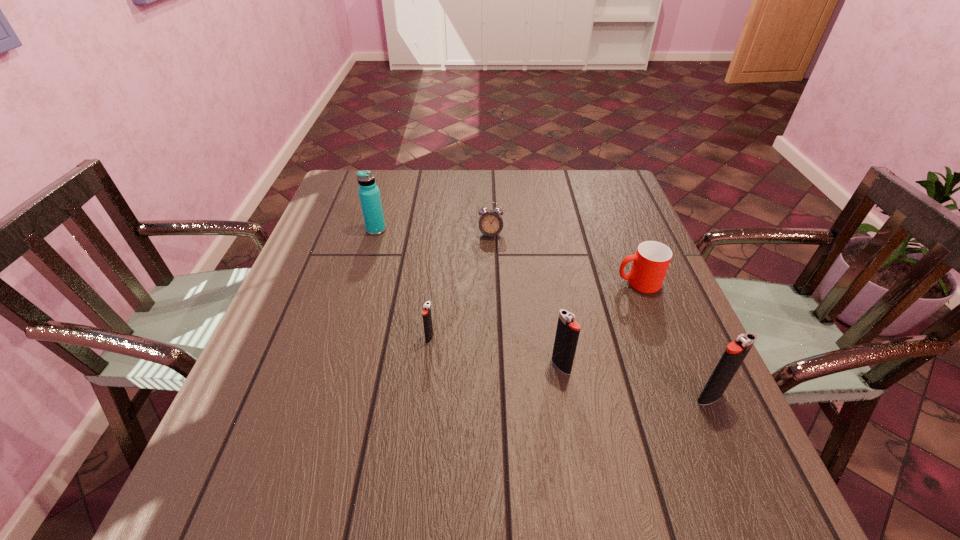
Identify the location of vacant area that satisfies the following two spatial constraints: 1. on the front side of the nearest igniter; 2. on the right side of the leftmost object. The image size is (960, 540). (326, 398).

At what (x,y) coordinates should I click in order to perform the action: click on free space that satisfies the following two spatial constraints: 1. on the front side of the leftmost object; 2. on the side of the third farthest object with the handle. Please return your answer as a coordinate pair (x, y). This screenshot has height=540, width=960. Looking at the image, I should click on (361, 283).

At what (x,y) coordinates should I click in order to perform the action: click on free space in the image that satisfies the following two spatial constraints: 1. on the face of the fourth object from right to left; 2. on the side of the cup with the handle. Please return your answer as a coordinate pair (x, y). Image resolution: width=960 pixels, height=540 pixels. Looking at the image, I should click on (492, 283).